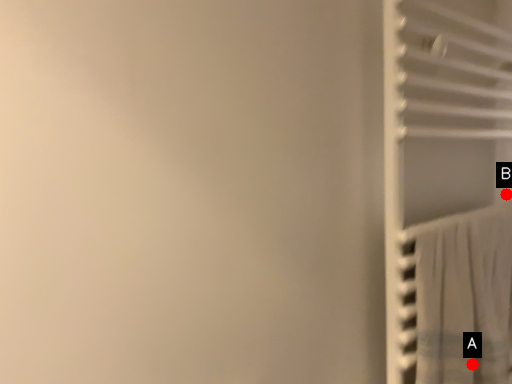
Question: Two points are circled on the image, labeled by A and B beside each circle. Which point is farther to the camera?

Choices:
 (A) A is further
 (B) B is further

Answer: (B)